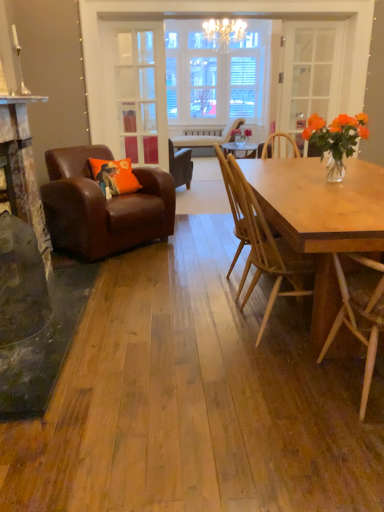
Image resolution: width=384 pixels, height=512 pixels. Identify the location of brown leather armchair at left, the third chair when ordered from bottom to top. (103, 206).

This screenshot has width=384, height=512. I want to click on natural wood chair at right, which ranks as the 3th chair in top-to-bottom order, so click(267, 251).

What do you see at coordinates (114, 176) in the screenshot?
I see `orange fabric pillow at left` at bounding box center [114, 176].

Identify the location of metallic silver fireplace at left. The image size is (384, 512). (21, 99).

What do you see at coordinates (21, 99) in the screenshot?
I see `metallic silver fireplace at left` at bounding box center [21, 99].

The image size is (384, 512). Describe the element at coordinates (137, 96) in the screenshot. I see `clear glass door at center, arranged as the first glass door when viewed from the left` at that location.

What do you see at coordinates (206, 138) in the screenshot? Image resolution: width=384 pixels, height=512 pixels. I see `leather armchair at center, which is counted as the first chair, starting from the back` at bounding box center [206, 138].

I want to click on light brown wooden chair at right, which is the first chair from bottom to top, so click(x=360, y=312).

This screenshot has height=512, width=384. What are the coordinates of `brown leather armchair at left, placed as the 2th chair when sorted from back to front` in the screenshot? It's located at (x=103, y=206).

Is point (112, 189) positioned in front of point (116, 50)?

That is True.

From the picture: Between orange fabric pillow at left and clear glass door at center, placed as the second glass door when sorted from right to left, which one has more height?

With more height is clear glass door at center, placed as the second glass door when sorted from right to left.

Which is more to the right, orange fabric pillow at left or clear glass door at center, placed as the second glass door when sorted from right to left?

From the viewer's perspective, clear glass door at center, placed as the second glass door when sorted from right to left, appears more on the right side.

From the image's perspective, which one is positioned lower, clear glass door at upper center, placed as the 2th glass door when sorted from left to right, or clear glass door at center, placed as the second glass door when sorted from right to left?

From the image's view, clear glass door at center, placed as the second glass door when sorted from right to left, is below.

How different are the orientations of clear glass door at upper center, placed as the 2th glass door when sorted from left to right, and clear glass door at center, placed as the second glass door when sorted from right to left, in degrees?

The angular difference between clear glass door at upper center, placed as the 2th glass door when sorted from left to right, and clear glass door at center, placed as the second glass door when sorted from right to left, is 162 degrees.

Which is behind, clear glass door at upper center, the 1th glass door positioned from the right, or clear glass door at center, placed as the second glass door when sorted from right to left?

clear glass door at upper center, the 1th glass door positioned from the right, is behind.

Could you tell me if clear glass door at upper center, the 1th glass door positioned from the right, is turned towards clear glass door at center, placed as the second glass door when sorted from right to left?

No, clear glass door at upper center, the 1th glass door positioned from the right, is not aimed at clear glass door at center, placed as the second glass door when sorted from right to left.

Is clear glass door at center, placed as the second glass door when sorted from right to left, taller or shorter than light brown wooden chair at right, which is the first chair from bottom to top?

Clearly, clear glass door at center, placed as the second glass door when sorted from right to left, is taller compared to light brown wooden chair at right, which is the first chair from bottom to top.

Is clear glass door at center, placed as the second glass door when sorted from right to left, at the left side of light brown wooden chair at right, which is the 1th chair from front to back?

Correct, you'll find clear glass door at center, placed as the second glass door when sorted from right to left, to the left of light brown wooden chair at right, which is the 1th chair from front to back.

From the image's perspective, which one is positioned lower, clear glass door at center, placed as the second glass door when sorted from right to left, or light brown wooden chair at right, which ranks as the 4th chair in top-to-bottom order?

From the image's view, light brown wooden chair at right, which ranks as the 4th chair in top-to-bottom order, is below.

You are a GUI agent. You are given a task and a screenshot of the screen. Output one action in this format:
    pyautogui.click(x=<x>, y=<y>)
    Task: Click on the 3rd chair to the right when counting from the clear glass door at center, arranged as the first glass door when viewed from the left
    
    Given the screenshot: What is the action you would take?
    pyautogui.click(x=360, y=312)

Would you say brown leather armchair at left, which ranks as the 3th chair in front-to-back order, is outside natural wood chair at right, which is the second chair in bottom-to-top order?

Yes, brown leather armchair at left, which ranks as the 3th chair in front-to-back order, is located beyond the bounds of natural wood chair at right, which is the second chair in bottom-to-top order.

Is brown leather armchair at left, placed as the 2th chair when sorted from back to front, next to natural wood chair at right, which is the second chair in bottom-to-top order, and touching it?

No, brown leather armchair at left, placed as the 2th chair when sorted from back to front, is not in contact with natural wood chair at right, which is the second chair in bottom-to-top order.

In the scene shown: Which object is closer to the camera taking this photo, brown leather armchair at left, placed as the 2th chair when sorted from back to front, or natural wood chair at right, which is the second chair in bottom-to-top order?

natural wood chair at right, which is the second chair in bottom-to-top order.

Measure the distance from brown leather armchair at left, marked as the second chair in a top-to-bottom arrangement, to natural wood chair at right, the 3th chair in the back-to-front sequence.

brown leather armchair at left, marked as the second chair in a top-to-bottom arrangement, is 1.51 meters away from natural wood chair at right, the 3th chair in the back-to-front sequence.

Do you think light brown wooden chair at right, which ranks as the 4th chair in top-to-bottom order, is within clear glass door at upper center, placed as the 2th glass door when sorted from left to right, or outside of it?

light brown wooden chair at right, which ranks as the 4th chair in top-to-bottom order, exists outside the volume of clear glass door at upper center, placed as the 2th glass door when sorted from left to right.

Is the surface of light brown wooden chair at right, which is the first chair from bottom to top, in direct contact with clear glass door at upper center, placed as the 2th glass door when sorted from left to right?

No, light brown wooden chair at right, which is the first chair from bottom to top, is not next to clear glass door at upper center, placed as the 2th glass door when sorted from left to right.

How much distance is there between light brown wooden chair at right, which ranks as the 4th chair in top-to-bottom order, and clear glass door at upper center, the 1th glass door positioned from the right?

The distance of light brown wooden chair at right, which ranks as the 4th chair in top-to-bottom order, from clear glass door at upper center, the 1th glass door positioned from the right, is 10.66 feet.

Which is behind, natural wood chair at right, which ranks as the 3th chair in top-to-bottom order, or light brown wooden chair at right, the fourth chair in the back-to-front sequence?

natural wood chair at right, which ranks as the 3th chair in top-to-bottom order, is further away from the camera.

In terms of width, does natural wood chair at right, which is the second chair in bottom-to-top order, look wider or thinner when compared to light brown wooden chair at right, which ranks as the 4th chair in top-to-bottom order?

natural wood chair at right, which is the second chair in bottom-to-top order, is thinner than light brown wooden chair at right, which ranks as the 4th chair in top-to-bottom order.

Could you measure the distance between natural wood chair at right, which is the second chair in bottom-to-top order, and light brown wooden chair at right, which is the first chair from bottom to top?

natural wood chair at right, which is the second chair in bottom-to-top order, is 40.33 centimeters from light brown wooden chair at right, which is the first chair from bottom to top.

From the image's perspective, which is below, natural wood chair at right, which is the second chair in bottom-to-top order, or light brown wooden chair at right, which is the first chair from bottom to top?

light brown wooden chair at right, which is the first chair from bottom to top, appears lower in the image.

From the image's perspective, which is above, clear glass door at center, arranged as the first glass door when viewed from the left, or natural wood chair at right, which ranks as the 3th chair in top-to-bottom order?

clear glass door at center, arranged as the first glass door when viewed from the left, appears higher in the image.

Considering the points (129, 137) and (304, 261), which point is in front, point (129, 137) or point (304, 261)?

The point (304, 261) is in front.

Is clear glass door at center, arranged as the first glass door when viewed from the left, wider than natural wood chair at right, which is the second chair in bottom-to-top order?

In fact, clear glass door at center, arranged as the first glass door when viewed from the left, might be narrower than natural wood chair at right, which is the second chair in bottom-to-top order.

Considering the relative sizes of clear glass door at center, arranged as the first glass door when viewed from the left, and natural wood chair at right, which ranks as the 3th chair in top-to-bottom order, in the image provided, is clear glass door at center, arranged as the first glass door when viewed from the left, taller than natural wood chair at right, which ranks as the 3th chair in top-to-bottom order,?

Indeed, clear glass door at center, arranged as the first glass door when viewed from the left, has a greater height compared to natural wood chair at right, which ranks as the 3th chair in top-to-bottom order.

The image size is (384, 512). Find the location of `pillow on the left side of clear glass door at center, placed as the second glass door when sorted from right to left`. pillow on the left side of clear glass door at center, placed as the second glass door when sorted from right to left is located at coordinates (114, 176).

The width and height of the screenshot is (384, 512). What are the coordinates of `glass door located above the clear glass door at center, arranged as the first glass door when viewed from the left (from the image's perspective)` in the screenshot? It's located at (310, 73).

Looking at the image, which one is located closer to natural wood chair at right, positioned as the second chair in front-to-back order, light brown wooden chair at right, which is the first chair from bottom to top, or leather armchair at center, which is counted as the first chair, starting from the back?

Based on the image, light brown wooden chair at right, which is the first chair from bottom to top, appears to be nearer to natural wood chair at right, positioned as the second chair in front-to-back order.

From the image, which object appears to be farther from brown leather armchair at left, the third chair when ordered from bottom to top, metallic silver fireplace at left or leather armchair at center, which is the fourth chair from front to back?

leather armchair at center, which is the fourth chair from front to back, lies further to brown leather armchair at left, the third chair when ordered from bottom to top, than the other object.

From the image, which object appears to be farther from clear glass door at upper center, placed as the 2th glass door when sorted from left to right, clear glass door at center, placed as the second glass door when sorted from right to left, or brown leather armchair at left, the third chair when ordered from bottom to top?

brown leather armchair at left, the third chair when ordered from bottom to top, is positioned further to the anchor clear glass door at upper center, placed as the 2th glass door when sorted from left to right.

Considering their positions, is brown leather armchair at left, placed as the 2th chair when sorted from back to front, positioned further to natural wood chair at right, which is the second chair in bottom-to-top order, than clear glass door at upper center, the 1th glass door positioned from the right?

clear glass door at upper center, the 1th glass door positioned from the right, is further to natural wood chair at right, which is the second chair in bottom-to-top order.

Looking at the image, which one is located closer to leather armchair at center, which is counted as the first chair, starting from the back, metallic silver fireplace at left or clear glass door at center, arranged as the first glass door when viewed from the left?

Based on the image, clear glass door at center, arranged as the first glass door when viewed from the left, appears to be nearer to leather armchair at center, which is counted as the first chair, starting from the back.

Which object lies further to the anchor point clear glass door at upper center, placed as the 2th glass door when sorted from left to right, light brown wooden chair at right, which is the 1th chair from front to back, or orange fabric pillow at left?

light brown wooden chair at right, which is the 1th chair from front to back.

Considering their positions, is orange fabric pillow at left positioned closer to clear glass door at upper center, placed as the 2th glass door when sorted from left to right, than natural wood chair at right, the 3th chair in the back-to-front sequence?

orange fabric pillow at left is closer to clear glass door at upper center, placed as the 2th glass door when sorted from left to right.

Considering their positions, is clear glass door at upper center, placed as the 2th glass door when sorted from left to right, positioned further to metallic silver fireplace at left than light brown wooden chair at right, the fourth chair in the back-to-front sequence?

light brown wooden chair at right, the fourth chair in the back-to-front sequence, is positioned further to the anchor metallic silver fireplace at left.

You are a GUI agent. You are given a task and a screenshot of the screen. Output one action in this format:
    pyautogui.click(x=<x>, y=<y>)
    Task: Click on the chair between natural wood chair at right, which ranks as the 3th chair in top-to-bottom order, and leather armchair at center, which is the 4th chair from bottom to top, in the front-back direction
    
    Given the screenshot: What is the action you would take?
    pyautogui.click(x=103, y=206)

You are a GUI agent. You are given a task and a screenshot of the screen. Output one action in this format:
    pyautogui.click(x=<x>, y=<y>)
    Task: Click on the counter top between natural wood chair at right, which ranks as the 3th chair in top-to-bottom order, and clear glass door at upper center, placed as the 2th glass door when sorted from left to right, along the z-axis
    The image size is (384, 512).
    Given the screenshot: What is the action you would take?
    pyautogui.click(x=21, y=99)

This screenshot has height=512, width=384. In order to click on glass door between orange fabric pillow at left and clear glass door at upper center, the 1th glass door positioned from the right in this screenshot , I will do `click(137, 96)`.

At what (x,y) coordinates should I click in order to perform the action: click on counter top between light brown wooden chair at right, which is the first chair from bottom to top, and clear glass door at center, arranged as the first glass door when viewed from the left, in the front-back direction. Please return your answer as a coordinate pair (x, y). The image size is (384, 512). Looking at the image, I should click on (21, 99).